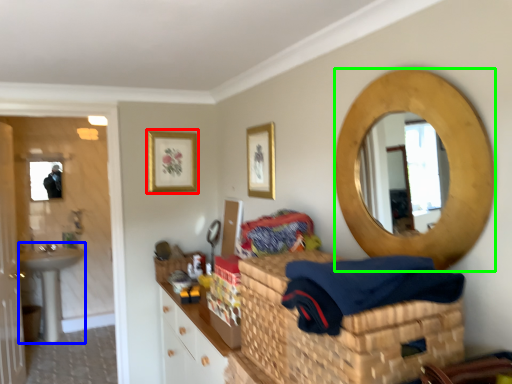
Question: Considering the real-world distances, which object is farthest from picture frame (highlighted by a red box)? sink (highlighted by a blue box) or oval (highlighted by a green box)?

Choices:
 (A) sink
 (B) oval

Answer: (A)